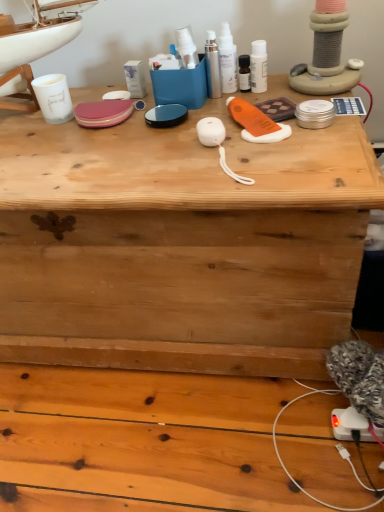
I want to click on free region on the left part of sleek silver spray at center, arranged as the third toiletry when viewed from the right, so click(132, 115).